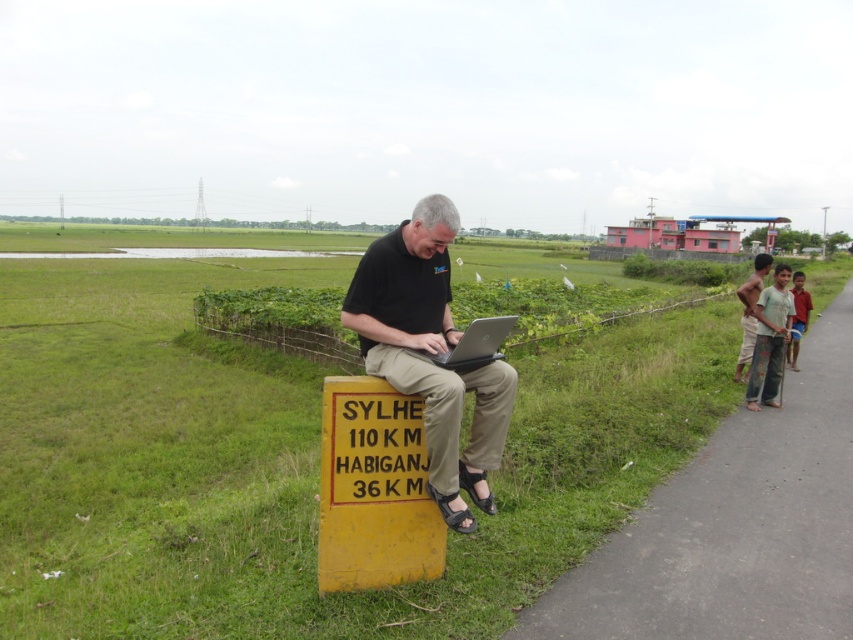
Can you confirm if asphalt road at right is positioned to the right of silver metallic laptop at center?

Yes, asphalt road at right is to the right of silver metallic laptop at center.

Does point (810, 428) come farther from viewer compared to point (440, 356)?

Yes.

The width and height of the screenshot is (853, 640). Find the location of `asphalt road at right`. asphalt road at right is located at coordinates (735, 525).

How far apart are black matte laptop at center and black leather sandal at lower center?

black matte laptop at center is 14.37 inches away from black leather sandal at lower center.

The image size is (853, 640). Describe the element at coordinates (428, 348) in the screenshot. I see `black matte laptop at center` at that location.

Find the location of a particular element. Image resolution: width=853 pixels, height=640 pixels. black matte laptop at center is located at coordinates click(x=428, y=348).

Which of these two, asphalt road at right or light brown pants at right, stands shorter?

asphalt road at right

Which is behind, point (630, 612) or point (776, 342)?

Point (776, 342)

Identify the location of asphalt road at right. (x=735, y=525).